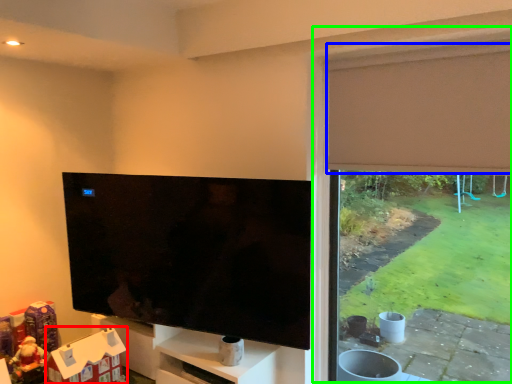
Question: Which is nearer to the toy (highlighted by a red box)? curtain (highlighted by a blue box) or window frame (highlighted by a green box).

Choices:
 (A) curtain
 (B) window frame

Answer: (B)